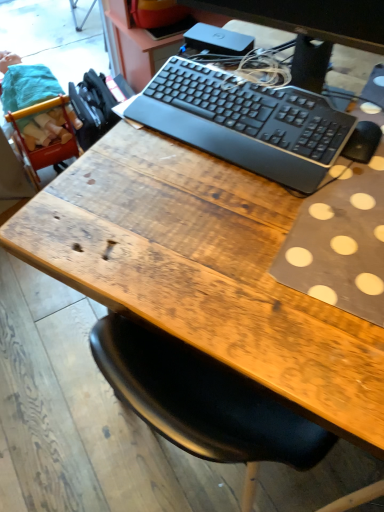
The width and height of the screenshot is (384, 512). In order to click on vacant area that is in front of black plastic keyboard at upper center in this screenshot , I will do `click(261, 213)`.